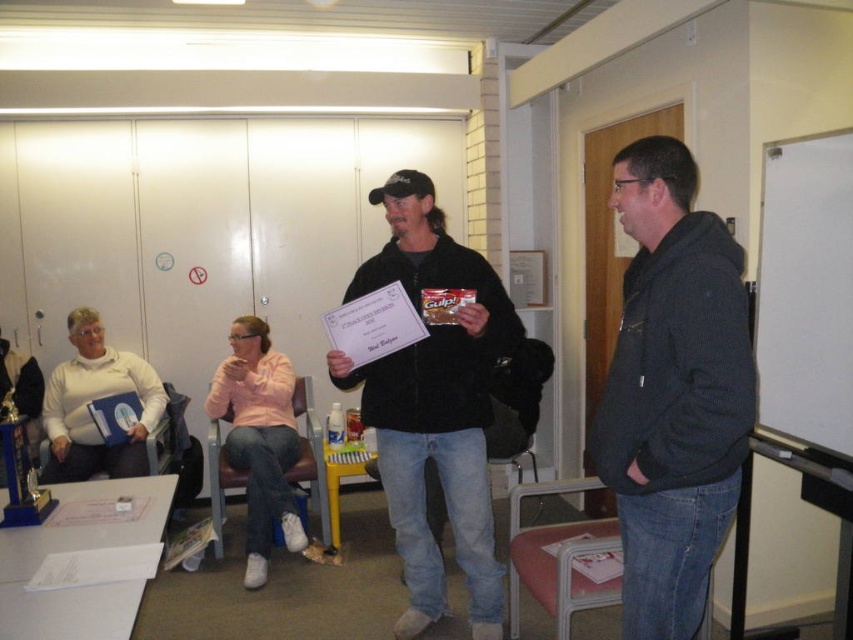
You are a photographer standing in the back of the room. You want to take a photo of both the dark gray hoodie at right and the black matte jacket at center. Which object should you focus on first to ensure both are in sharp focus?

You should focus on the dark gray hoodie at right first because it is closer to the viewer than the black matte jacket at center, so adjusting focus from near to far will help both be in sharp focus.

You are standing in the conference room and need to place a new plant pot exactly at the coordinates where the dark gray hoodie at right is located. What object will the plant pot be placed next to or near?

The dark gray hoodie at right is located at point (672, 392), so the plant pot will be placed next to or near the dark gray hoodie at right.

You are standing in the conference room and need to place a 1.2 meter tall plant next to the black matte jacket at center and the white matte board at right. Based on their heights, which object should the plant be placed next to?

The black matte jacket at center has a greater height compared to the white matte board at right, so the plant should be placed next to the white matte board at right to maintain visual balance.